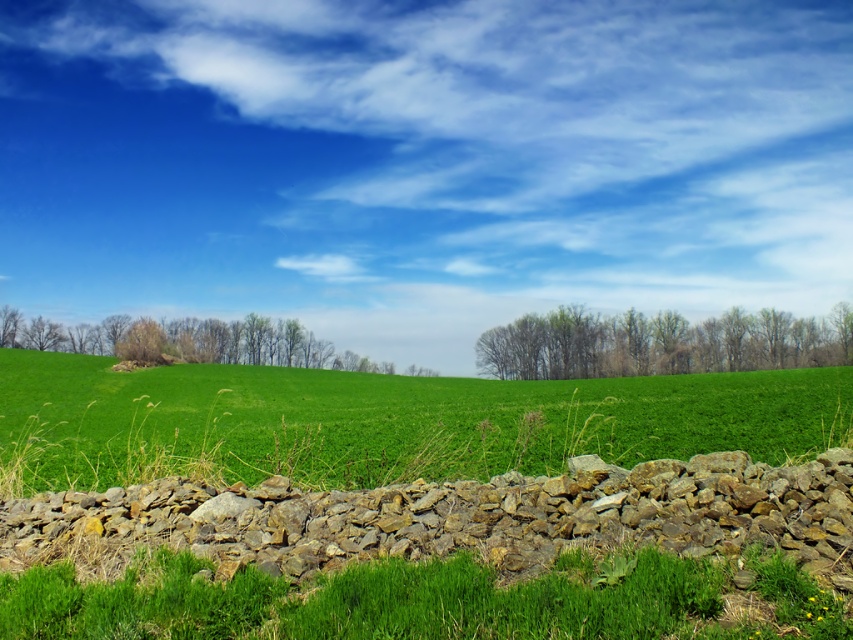
You are standing in the middle of the field and see the rustic stone wall at center and the green leafy tree at left. Which object is closer to you?

The rustic stone wall at center is closer to you because it is positioned in front of the green leafy tree at left.

You are standing on the low stone wall in the foreground and want to walk to the green leafy tree at left. Which direction should you go to reach it without crossing the green grassy field at center?

You should walk to the left side of the green grassy field at center because the green leafy tree at left is positioned to the left of the field, and since the field is wider than the tree, moving left avoids crossing the field.

Looking at this image, you are standing in the middle of the field and see the rustic stone wall at center and the green leafy trees at center. Which object is closer to you?

The rustic stone wall at center is closer to you because it is positioned below the green leafy trees at center, indicating it is in a lower plane and thus nearer in the scene.